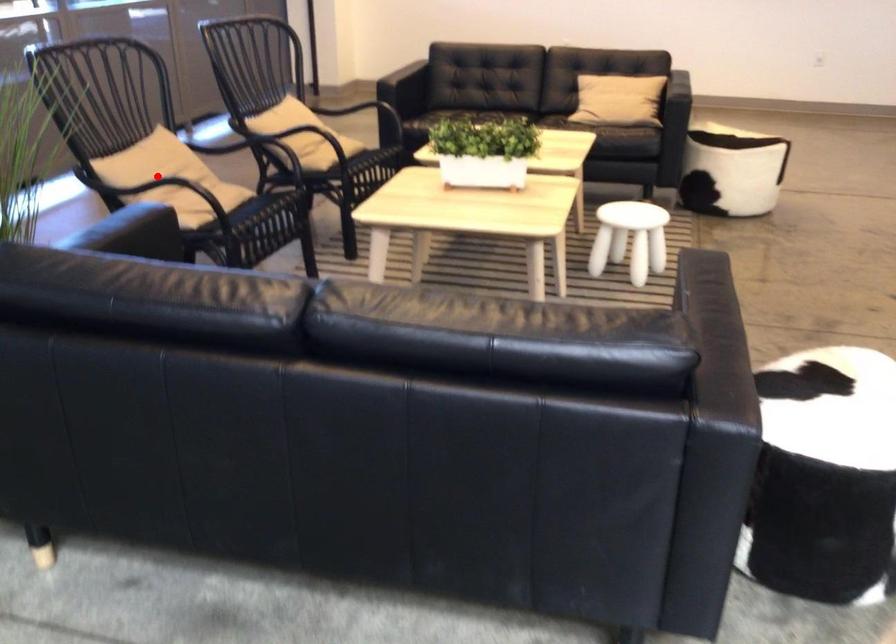
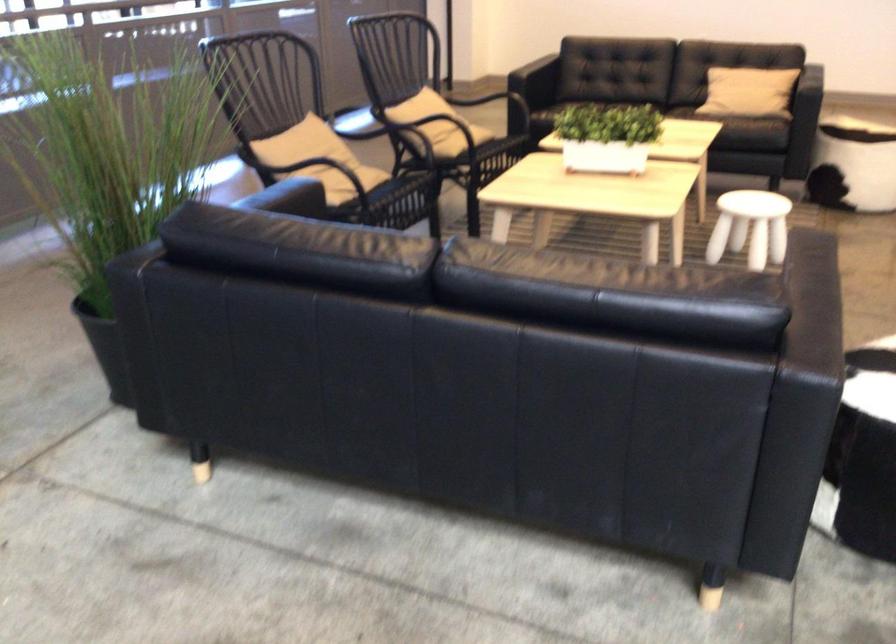
Question: I am providing you with two images of the same scene from different viewpoints. In image1, a red point is highlighted. Considering the same 3D point in image2, which of the following is correct?

Choices:
 (A) It is closer
 (B) It is farther

Answer: (B)